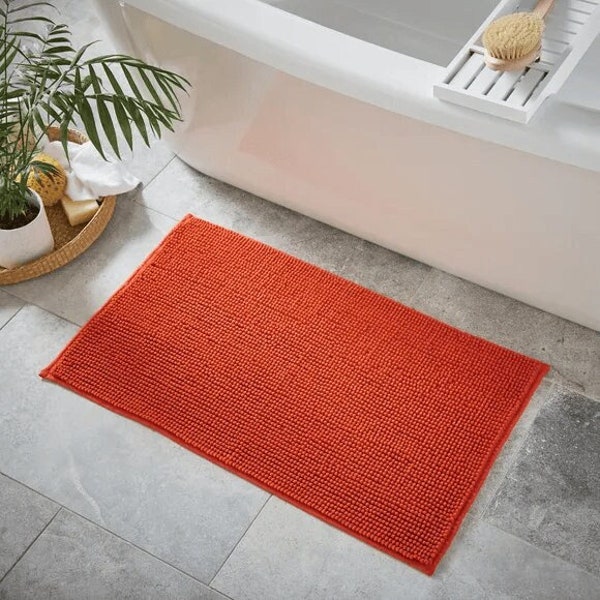
You are a GUI agent. You are given a task and a screenshot of the screen. Output one action in this format:
    pyautogui.click(x=<x>, y=<y>)
    Task: Click on the orange bathroom mat
    The width and height of the screenshot is (600, 600).
    Given the screenshot: What is the action you would take?
    pyautogui.click(x=329, y=370)